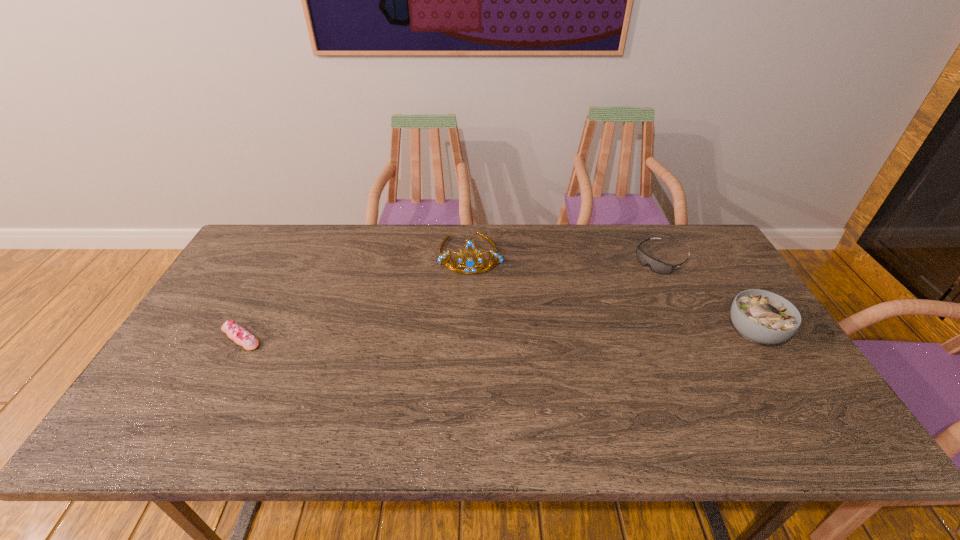
Locate an element on the screen. The width and height of the screenshot is (960, 540). free space on the desktop that is between the shortest object and the soup bowl and is positioned on the front-facing side of the tiara is located at coordinates (470, 335).

Identify the location of vacant space on the desktop that is between the shortest object and the soup bowl and is positioned on the lenses of the second shortest object. (555, 334).